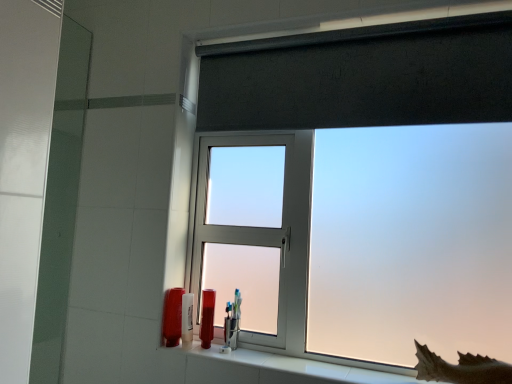
Question: In terms of size, does clear plastic toothbrush holder at center, the 1th toiletry viewed from the right, appear bigger or smaller than frosted glass window at upper center?

Choices:
 (A) small
 (B) big

Answer: (A)

Question: Considering the positions of clear plastic toothbrush holder at center, the fourth toiletry when ordered from left to right, and frosted glass window at upper center in the image, is clear plastic toothbrush holder at center, the fourth toiletry when ordered from left to right, taller or shorter than frosted glass window at upper center?

Choices:
 (A) short
 (B) tall

Answer: (A)

Question: Which object is positioned farthest from the translucent plastic toothbrush at lower center, which appears as the third toiletry when viewed from the right?

Choices:
 (A) frosted plastic shark fin at lower right
 (B) frosted glass window at upper center
 (C) clear plastic toothbrush holder at center, the 1th toiletry viewed from the right
 (D) white ceramic window sill at lower center
 (E) black textured roller blind at upper center

Answer: (E)

Question: Which of these objects is positioned farthest from the black textured roller blind at upper center?

Choices:
 (A) frosted plastic shark fin at lower right
 (B) matte plastic toothbrush at lower left, arranged as the 4th toiletry when viewed from the right
 (C) white ceramic window sill at lower center
 (D) translucent plastic tube at lower center, the 3th toiletry viewed from the left
 (E) frosted glass window at upper center

Answer: (B)